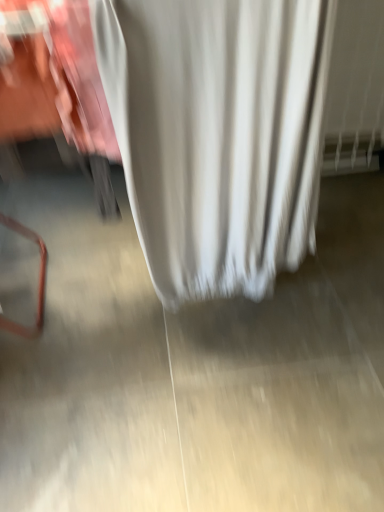
Measure the distance between point (157, 225) and camera.

Point (157, 225) and camera are 1.07 meters apart from each other.

Describe the element at coordinates (217, 135) in the screenshot. This screenshot has width=384, height=512. I see `white fabric curtain at center` at that location.

What are the coordinates of `white fabric curtain at center` in the screenshot? It's located at (217, 135).

Where is `smooth concrete floor at center`? Image resolution: width=384 pixels, height=512 pixels. smooth concrete floor at center is located at coordinates (179, 384).

This screenshot has width=384, height=512. What do you see at coordinates (179, 384) in the screenshot?
I see `smooth concrete floor at center` at bounding box center [179, 384].

Locate an element on the screen. white fabric curtain at center is located at coordinates (217, 135).

Is smooth concrete floor at center at the right side of white fabric curtain at center?

Correct, you'll find smooth concrete floor at center to the right of white fabric curtain at center.

Does smooth concrete floor at center lie in front of white fabric curtain at center?

No, it is behind white fabric curtain at center.

Which is farther, (320, 390) or (285, 111)?

The point (320, 390) is more distant.

From the image's perspective, between smooth concrete floor at center and white fabric curtain at center, who is located below?

From the image's view, smooth concrete floor at center is below.

From a real-world perspective, which object rests below the other?

In real-world perspective, smooth concrete floor at center is lower.

Which of these two, smooth concrete floor at center or white fabric curtain at center, is thinner?

With smaller width is white fabric curtain at center.

Is smooth concrete floor at center shorter than white fabric curtain at center?

Indeed, smooth concrete floor at center has a lesser height compared to white fabric curtain at center.

Can you confirm if smooth concrete floor at center is smaller than white fabric curtain at center?

Yes.

Is smooth concrete floor at center inside or outside of white fabric curtain at center?

The correct answer is: outside.

Is there a large distance between smooth concrete floor at center and white fabric curtain at center?

That's not correct — smooth concrete floor at center is a little close to white fabric curtain at center.

Is smooth concrete floor at center facing towards white fabric curtain at center?

No, smooth concrete floor at center is not oriented towards white fabric curtain at center.

In the scene shown: How many degrees apart are the facing directions of smooth concrete floor at center and white fabric curtain at center?

The angle between the facing direction of smooth concrete floor at center and the facing direction of white fabric curtain at center is 89.7 degrees.

The width and height of the screenshot is (384, 512). In the image, there is a white fabric curtain at center. Find the location of `concrete below it (from the image's perspective)`. concrete below it (from the image's perspective) is located at coordinates (179, 384).

Between white fabric curtain at center and smooth concrete floor at center, which one appears on the right side from the viewer's perspective?

smooth concrete floor at center is more to the right.

Is the depth of white fabric curtain at center less than that of smooth concrete floor at center?

Yes, white fabric curtain at center is closer to the viewer.

Which is less distant, (292, 175) or (7, 372)?

Point (292, 175) is positioned closer to the camera compared to point (7, 372).

Consider the image. From the image's perspective, relative to smooth concrete floor at center, is white fabric curtain at center above or below?

Based on their image positions, white fabric curtain at center is located above smooth concrete floor at center.

From a real-world perspective, is white fabric curtain at center on smooth concrete floor at center?

Correct, in the physical world, white fabric curtain at center is higher than smooth concrete floor at center.

Does white fabric curtain at center have a greater width compared to smooth concrete floor at center?

Incorrect, the width of white fabric curtain at center does not surpass that of smooth concrete floor at center.

In terms of height, does white fabric curtain at center look taller or shorter compared to smooth concrete floor at center?

Considering their sizes, white fabric curtain at center has more height than smooth concrete floor at center.

Looking at the image, does white fabric curtain at center seem bigger or smaller compared to smooth concrete floor at center?

Considering their sizes, white fabric curtain at center takes up more space than smooth concrete floor at center.

From the picture: Can smooth concrete floor at center be found inside white fabric curtain at center?

No, smooth concrete floor at center is not surrounded by white fabric curtain at center.

Is white fabric curtain at center not close to smooth concrete floor at center?

No, white fabric curtain at center is not far from smooth concrete floor at center.

Is smooth concrete floor at center at the back of white fabric curtain at center?

No, white fabric curtain at center's orientation is not away from smooth concrete floor at center.

What's the angular difference between white fabric curtain at center and smooth concrete floor at center's facing directions?

The angle between the facing direction of white fabric curtain at center and the facing direction of smooth concrete floor at center is 89.7 degrees.

The width and height of the screenshot is (384, 512). I want to click on curtain above the smooth concrete floor at center (from a real-world perspective), so click(217, 135).

There is a smooth concrete floor at center. Where is `curtain above it (from a real-world perspective)`? The width and height of the screenshot is (384, 512). curtain above it (from a real-world perspective) is located at coordinates (217, 135).

At what (x,y) coordinates should I click in order to perform the action: click on curtain lying above the smooth concrete floor at center (from the image's perspective). Please return your answer as a coordinate pair (x, y). Looking at the image, I should click on (217, 135).